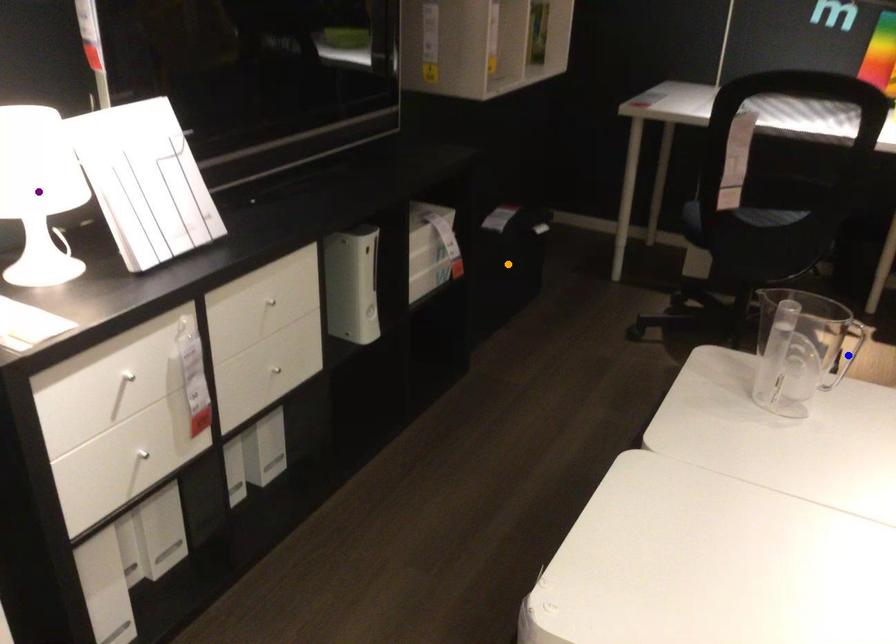
Order these from nearest to farthest:
orange point, blue point, purple point

purple point → blue point → orange point